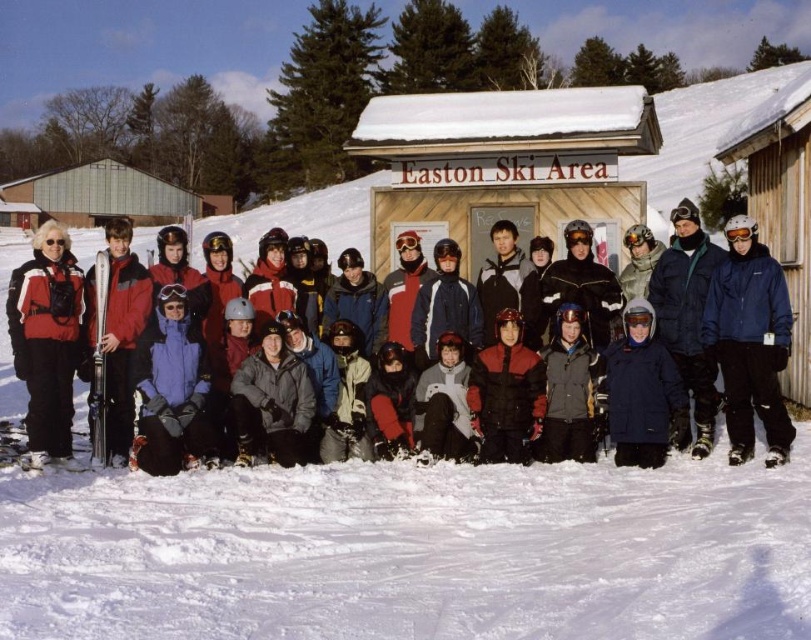
You are standing at the Easton Ski Area and want to take a photo of the wooden sign at center. If your camera has a maximum focus range of 10 meters, will you need to move closer to the sign to take a clear photo?

The wooden sign at center is 11.31 meters away from the camera, which exceeds the camera maximum focus range of 10 meters. Therefore, you need to move closer to the wooden sign at center to ensure a clear photo.

You are standing at the entrance of Easton Ski Area and see the matte red jacket at left and the brushed metal hut at upper left. Which object is closer to you?

The matte red jacket at left is closer to you because it is located below the brushed metal hut at upper left, which is positioned higher up in the image.

You are standing at the entrance of Easton Ski Area and see two people wearing jackets. One is wearing a matte black jacket at center and the other a matte red jacket at left. Which jacket is positioned to the left of the other?

The matte black jacket at center is positioned on the left side of matte red jacket at left.